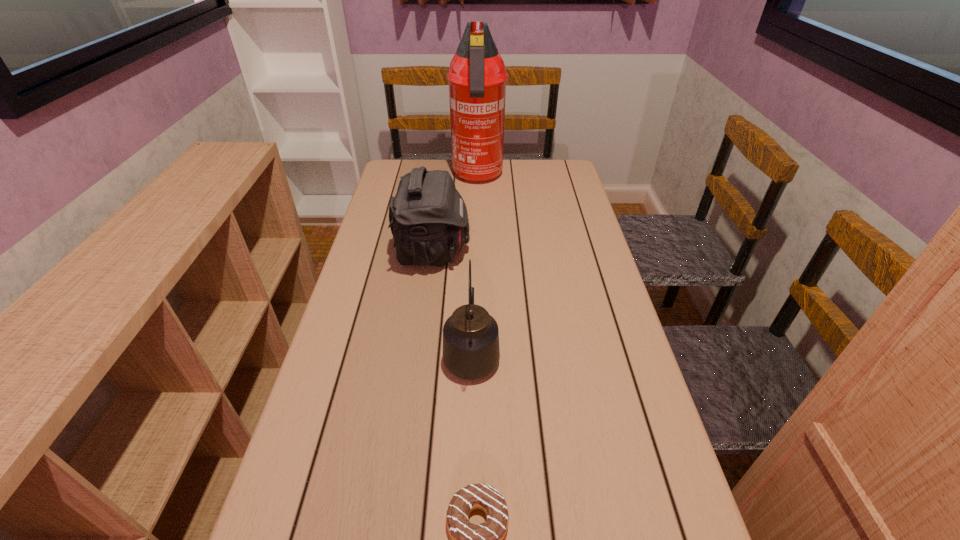
Image resolution: width=960 pixels, height=540 pixels. In order to click on object that is at the left edge in this screenshot , I will do `click(428, 217)`.

Where is `vacant space at the far edge of the desktop`? Image resolution: width=960 pixels, height=540 pixels. vacant space at the far edge of the desktop is located at coordinates (435, 161).

In the image, there is a desktop. Where is `vacant area at the left edge`? This screenshot has width=960, height=540. vacant area at the left edge is located at coordinates (x=380, y=249).

Identify the location of vacant space at the right edge. This screenshot has width=960, height=540. (590, 417).

Find the location of `free spot at the far right corner of the desktop`. free spot at the far right corner of the desktop is located at coordinates (562, 164).

Locate an element on the screen. empty space that is in between the tallest object and the second nearest object is located at coordinates (474, 265).

In order to click on free space between the kettle and the second farthest object in this screenshot , I will do coord(452,302).

The image size is (960, 540). Identify the location of vacant area that lies between the farthest object and the kettle. (474, 265).

Where is `the third closest object relative to the shoulder bag`? The width and height of the screenshot is (960, 540). the third closest object relative to the shoulder bag is located at coordinates (485, 539).

Locate an element on the screen. object that ranks as the closest to the third farthest object is located at coordinates (428, 217).